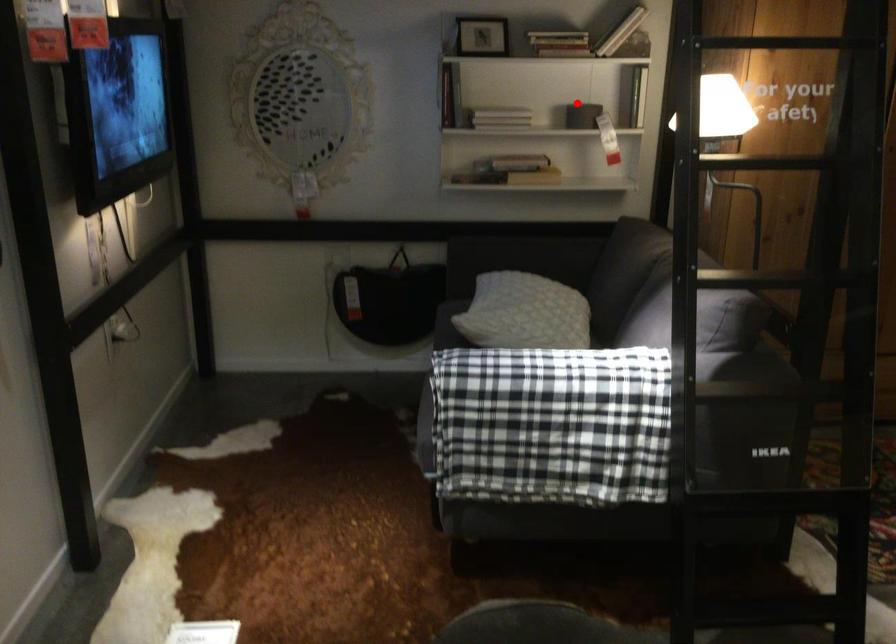
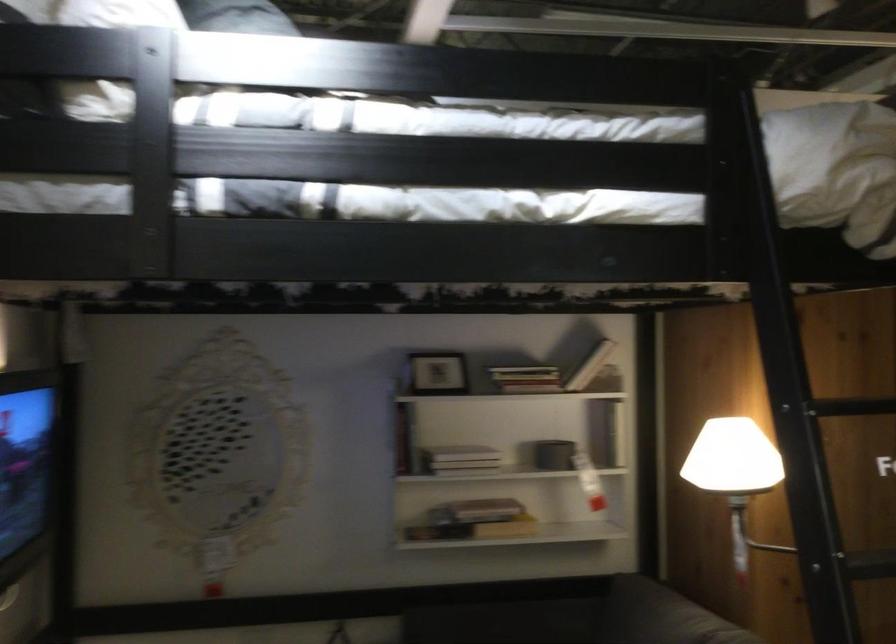
Question: I am providing you with two images of the same scene from different viewpoints. Given a red point in image1, look at the same physical point in image2. Is it:

Choices:
 (A) Closer to the viewpoint
 (B) Farther from the viewpoint

Answer: (A)